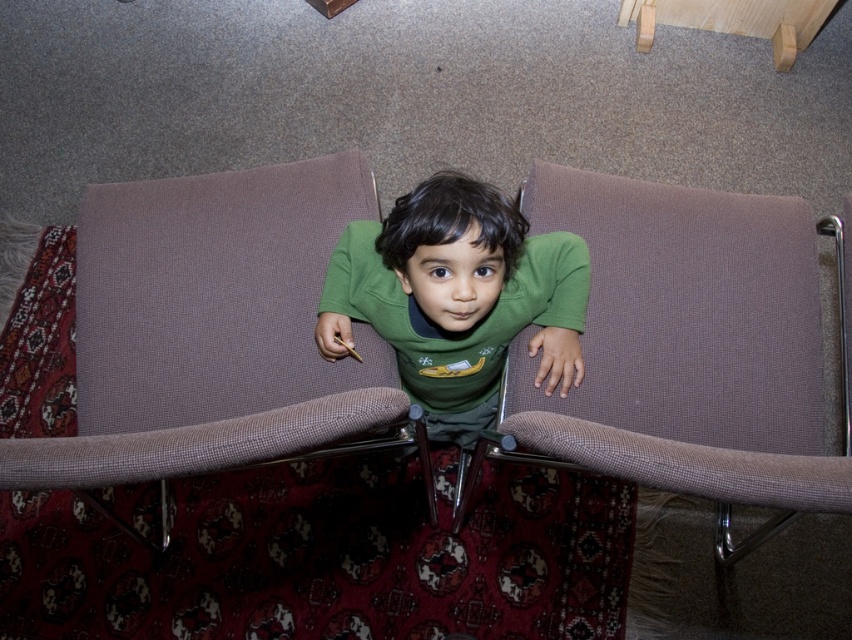
Who is shorter, brown fabric couch at left or brown fabric couch at center?

brown fabric couch at left

Who is more forward, (x=229, y=349) or (x=737, y=236)?

Point (x=229, y=349) is more forward.

Locate an element on the screen. This screenshot has height=640, width=852. brown fabric couch at left is located at coordinates click(210, 328).

Does brown fabric couch at center have a smaller size compared to green matte shirt at center?

Incorrect, brown fabric couch at center is not smaller in size than green matte shirt at center.

Which is behind, point (616, 333) or point (484, 218)?

Point (616, 333)

Describe the element at coordinates (688, 348) in the screenshot. I see `brown fabric couch at center` at that location.

You are a GUI agent. You are given a task and a screenshot of the screen. Output one action in this format:
    pyautogui.click(x=<x>, y=<y>)
    Task: Click on the brown fabric couch at center
    
    Given the screenshot: What is the action you would take?
    pyautogui.click(x=688, y=348)

Identify the location of brown fabric couch at left. tap(210, 328).

Based on the photo, which is more to the right, brown fabric couch at left or green matte shirt at center?

From the viewer's perspective, green matte shirt at center appears more on the right side.

Where is `brown fabric couch at left`? brown fabric couch at left is located at coordinates (210, 328).